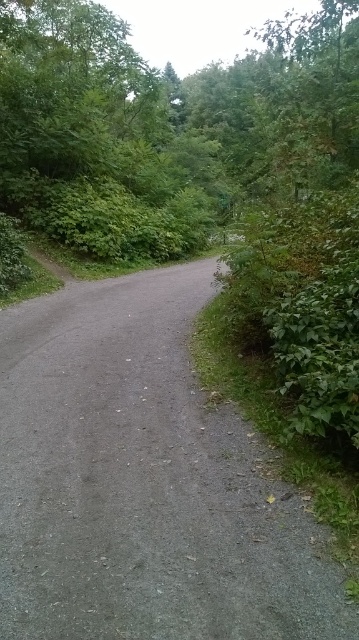
Question: Can you confirm if gray gravel road at center is positioned above green leafy tree at center?

Choices:
 (A) yes
 (B) no

Answer: (B)

Question: Is the position of gray gravel road at center less distant than that of green leafy tree at center?

Choices:
 (A) yes
 (B) no

Answer: (A)

Question: Does gray gravel road at center have a greater width compared to green leafy tree at center?

Choices:
 (A) yes
 (B) no

Answer: (B)